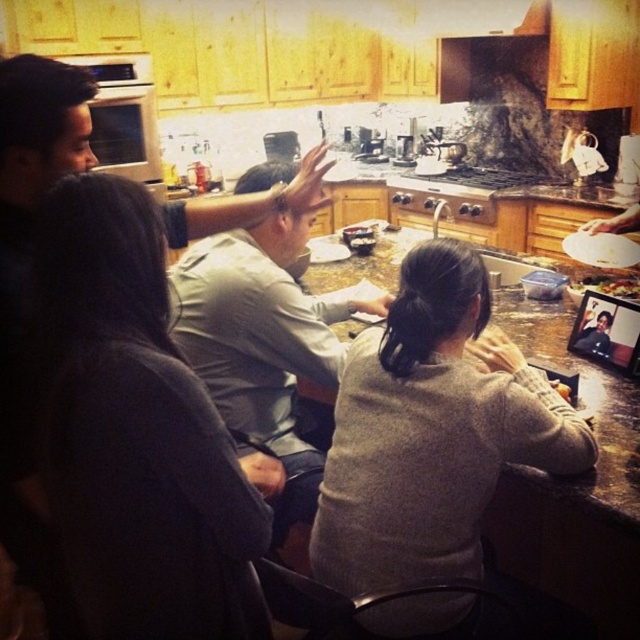
Question: Where is granite gray counter top at center located in relation to smooth white plate at lower right in the image?

Choices:
 (A) below
 (B) above

Answer: (B)

Question: Is light gray shirt at center bigger than granite gray counter top at center?

Choices:
 (A) no
 (B) yes

Answer: (B)

Question: Which of the following is the farthest from the observer?

Choices:
 (A) (420, 236)
 (B) (621, 284)
 (C) (321, 378)
 (D) (234, 512)

Answer: (A)

Question: Estimate the real-world distances between objects in this image. Which object is farther from the granite gray counter top at center?

Choices:
 (A) smooth white plate at lower right
 (B) shiny plastic plate at right

Answer: (A)

Question: Among these objects, which one is nearest to the camera?

Choices:
 (A) green leafy salad at center
 (B) dark gray sweater at upper left
 (C) granite gray counter top at center

Answer: (B)

Question: Is granite gray counter top at center above green leafy salad at center?

Choices:
 (A) yes
 (B) no

Answer: (B)